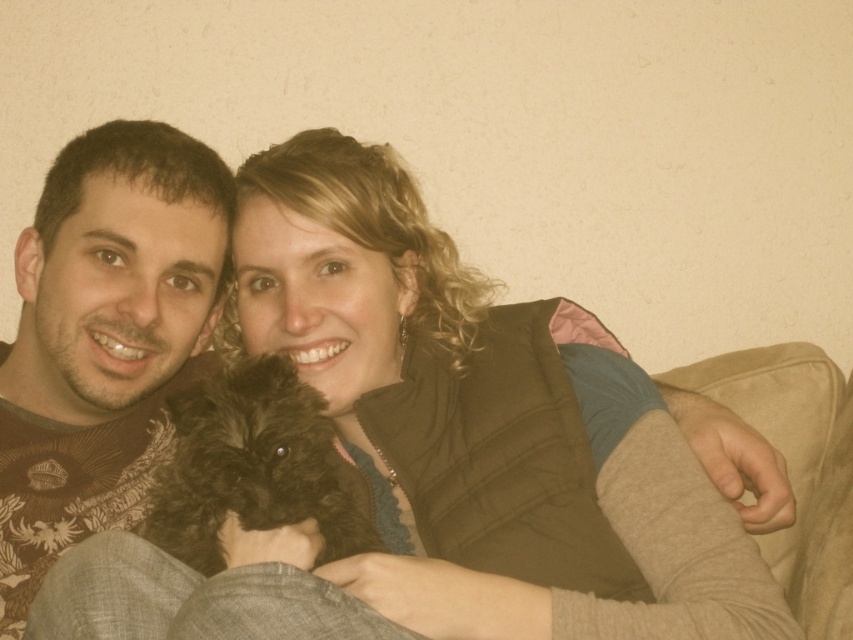
You are standing in a room and want to reach a specific point marked at coordinates point [132,364]. If you can move 4 feet forward, will you be able to reach that point?

The distance of point [132,364] from viewer is 3.99 feet, so moving 4 feet forward will allow you to reach it since the distance is slightly less than the movement.

You are a photographer setting up a photo shoot in this living room. You need to ensure that the dark brown sweater at left and the black fluffy dog at center are both clearly visible in the frame. Given their sizes, which object might require more space in the composition to avoid being cropped out?

The dark brown sweater at left has a larger size compared to the black fluffy dog at center, so it would require more space in the composition to avoid being cropped out.

You are standing in the room where the two people are sitting on the beige couch. You want to place a small gift box at point (190,224) and another gift box at point (189,435). Which gift box will be closer to the wall behind the couch?

The gift box placed at point (190,224) will be closer to the wall behind the couch because point (190,224) is behind point (189,435).